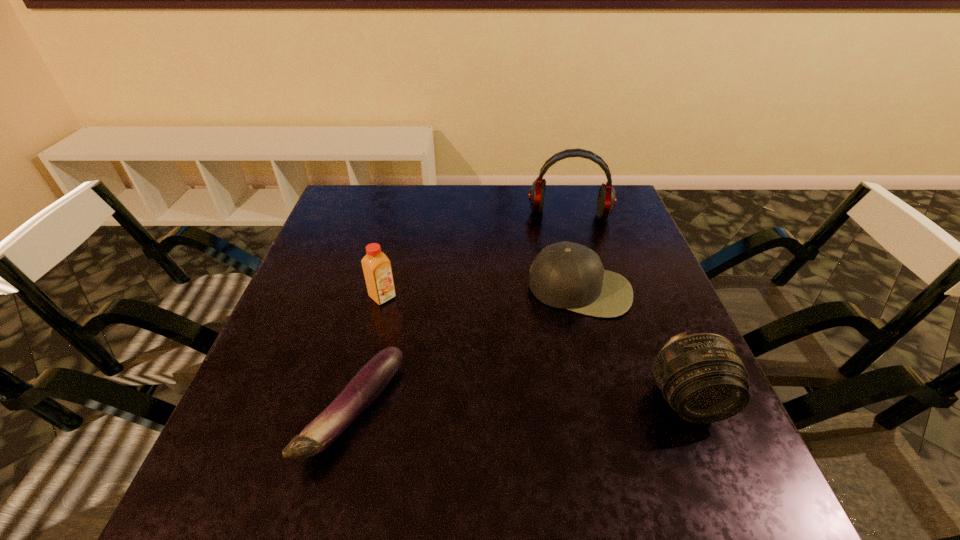
The height and width of the screenshot is (540, 960). I want to click on the shortest object, so click(365, 386).

Image resolution: width=960 pixels, height=540 pixels. Find the location of `telephoto lens`. telephoto lens is located at coordinates (703, 377).

Identify the location of earphone. Image resolution: width=960 pixels, height=540 pixels. (606, 201).

Find the location of a particular element. This screenshot has height=540, width=960. the tallest object is located at coordinates (606, 201).

Locate an element on the screen. This screenshot has height=540, width=960. orange juice is located at coordinates coord(376,266).

At what (x,y) coordinates should I click in order to perform the action: click on the second shortest object. Please return your answer as a coordinate pair (x, y). This screenshot has width=960, height=540. Looking at the image, I should click on (566, 275).

What are the coordinates of `vacant area located 0.130m on the back of the eggplant` in the screenshot? It's located at (377, 314).

Find the location of a particular element. free point located on the ear cups of the earphone is located at coordinates (564, 292).

Image resolution: width=960 pixels, height=540 pixels. Find the location of `vacant region located on the ear cups of the earphone`. vacant region located on the ear cups of the earphone is located at coordinates (564, 298).

The image size is (960, 540). What are the coordinates of `vacant space located on the ear cups of the earphone` in the screenshot? It's located at (564, 286).